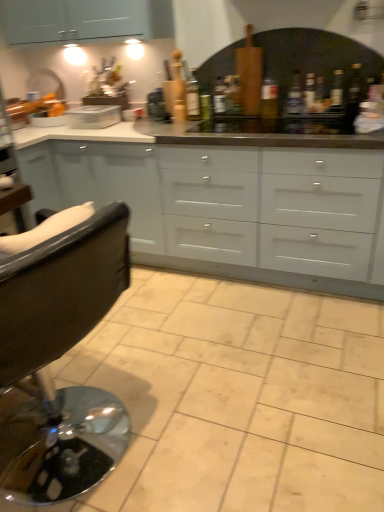
Where is `free space to the back side of black leather chair at left`? free space to the back side of black leather chair at left is located at coordinates (133, 348).